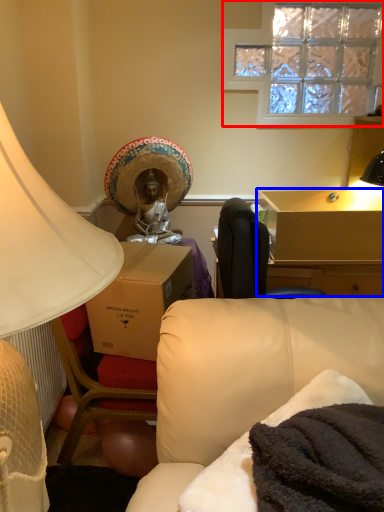
Question: Among these objects, which one is nearest to the camera, window (highlighted by a red box) or table (highlighted by a blue box)?

Choices:
 (A) window
 (B) table

Answer: (B)